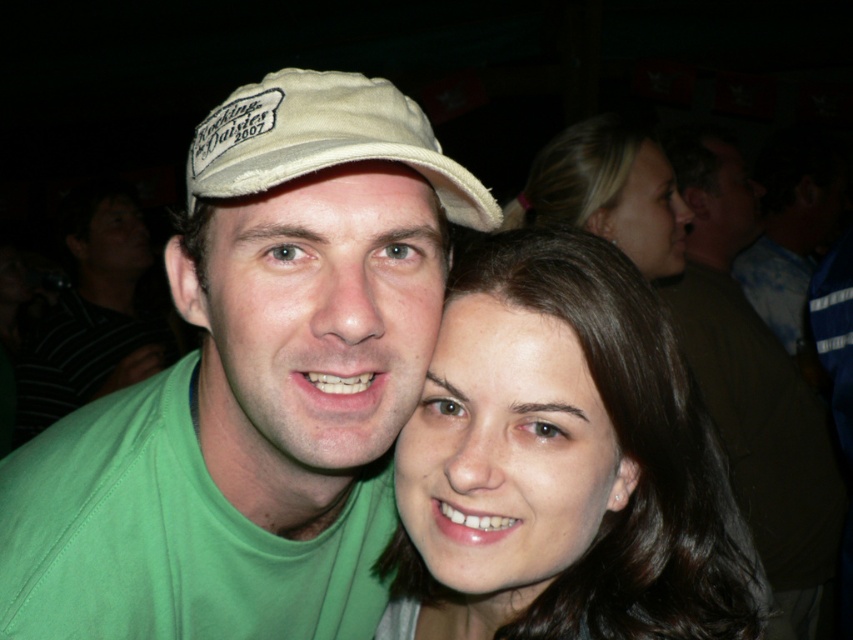
Question: Considering the real-world distances, which object is farthest from the smooth skin face at center?

Choices:
 (A) matte khaki cap at center
 (B) matte beige cap at center

Answer: (A)

Question: Among these points, which one is nearest to the camera?

Choices:
 (A) (631, 221)
 (B) (288, 442)
 (C) (109, 324)

Answer: (B)

Question: Considering the relative positions of matte beige cap at center and smooth skin face at upper right in the image provided, where is matte beige cap at center located with respect to smooth skin face at upper right?

Choices:
 (A) below
 (B) above

Answer: (A)

Question: Can you confirm if matte khaki cap at center is positioned to the right of green fabric shirt at left?

Choices:
 (A) yes
 (B) no

Answer: (A)

Question: Does matte beige cap at center appear on the left side of beige cotton cap at upper center?

Choices:
 (A) yes
 (B) no

Answer: (A)

Question: Which is nearer to the matte khaki cap at center?

Choices:
 (A) beige cotton cap at upper center
 (B) matte beige cap at center
 (C) smooth skin face at center
 (D) smooth brown hair at center

Answer: (B)